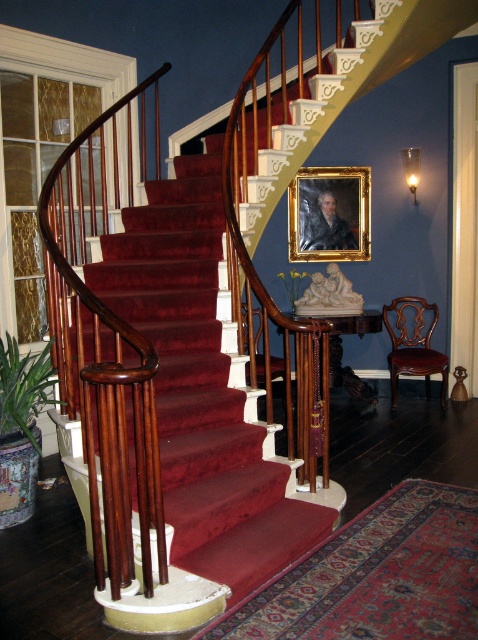
You are standing at the bottom of the staircase and want to reach the landing at the top. The mahogany wood stairs at center and the mahogany wood railing at left are in your way. Which one do you need to climb over to reach the landing?

The mahogany wood stairs at center is much taller than the mahogany wood railing at left, so you need to climb over the mahogany wood stairs at center to reach the landing.

You are standing at the bottom of the staircase and want to hang a decorative wreath on the wall between the mahogany wood railing at left and the goldwooden frame at center. Which object is closer to you so that you can reach it first?

The mahogany wood railing at left is closer to the viewer than the goldwooden frame at center, so you can reach it first.

You are standing at the entrance of the grand staircase and need to locate the mahogany wood railing at left. According to the coordinates provided, where exactly should you look to find it?

The mahogany wood railing at left is located at coordinates point (106, 340).